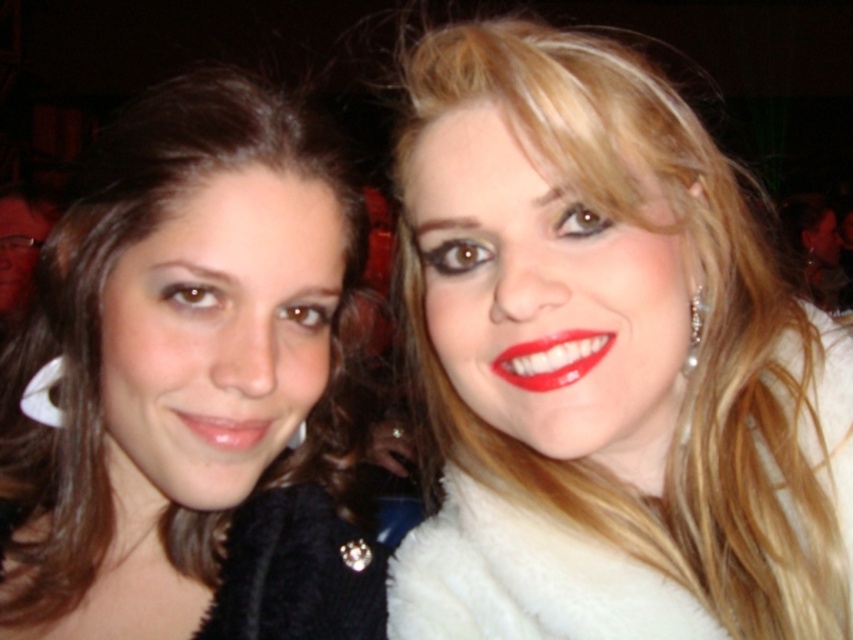
Can you confirm if white fur coat at right is positioned to the right of matte red lipstick at center?

Yes, white fur coat at right is to the right of matte red lipstick at center.

Does white fur coat at right have a greater height compared to matte red lipstick at center?

Yes, white fur coat at right is taller than matte red lipstick at center.

Which is in front, point (476, 259) or point (581, 368)?

Point (581, 368)

The height and width of the screenshot is (640, 853). In order to click on white fur coat at right in this screenshot , I will do `click(607, 362)`.

Is point (341, 528) behind point (262, 435)?

Yes, point (341, 528) is farther from viewer.

Locate an element on the screen. matte black fur coat at left is located at coordinates (190, 385).

Is point (537, 371) closer to viewer compared to point (247, 433)?

Yes, it is in front of point (247, 433).

Is matte red lipstick at center thinner than matte pink lipstick at lower left?

Incorrect, matte red lipstick at center's width is not less than matte pink lipstick at lower left's.

The width and height of the screenshot is (853, 640). Find the location of `matte red lipstick at center`. matte red lipstick at center is located at coordinates (552, 358).